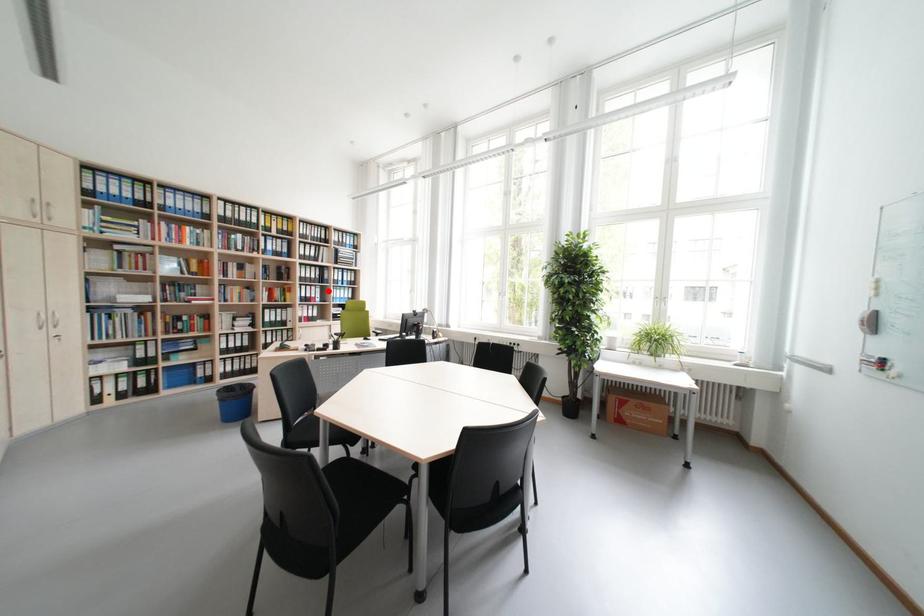
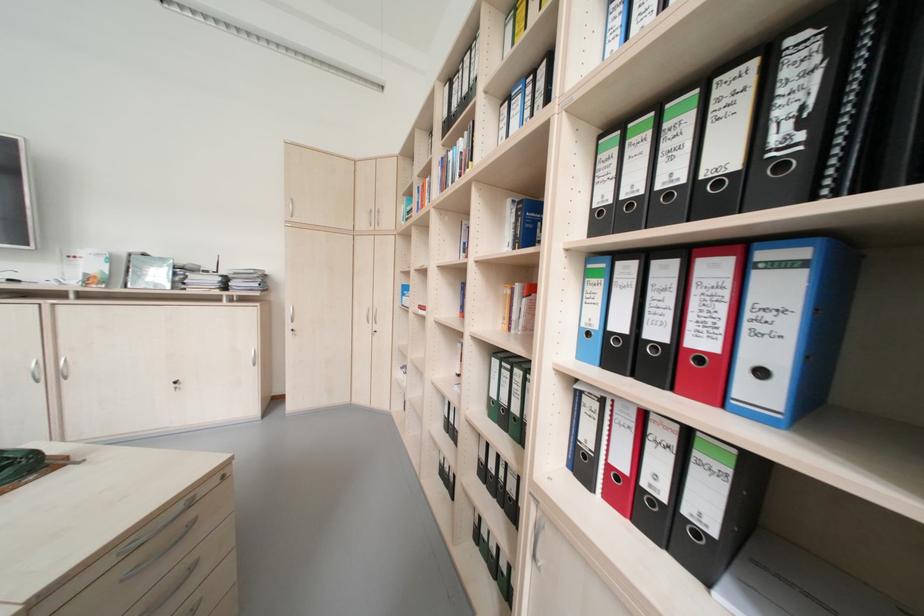
Locate, in the second image, the point that corresponds to the highlighted location in the first image.

(793, 290)